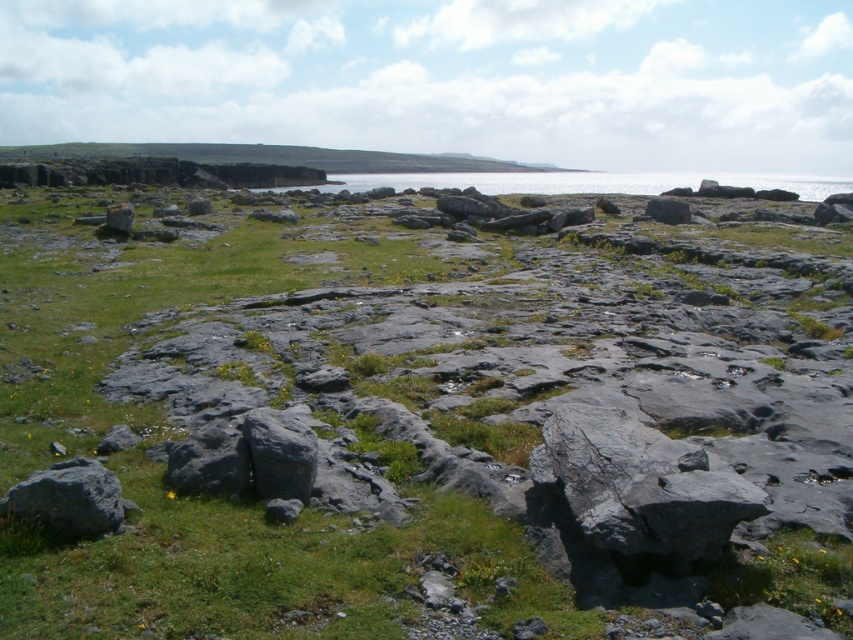
Can you confirm if green grassy hillside at upper center is thinner than gray rough rock at center?

In fact, green grassy hillside at upper center might be wider than gray rough rock at center.

Is green grassy hillside at upper center wider than gray rough rock at center?

Indeed, green grassy hillside at upper center has a greater width compared to gray rough rock at center.

This screenshot has width=853, height=640. What are the coordinates of `green grassy hillside at upper center` in the screenshot? It's located at 277,156.

Identify the location of green grassy hillside at upper center. This screenshot has height=640, width=853. (277, 156).

Is gray rock at center to the left of gray rough rock at lower left from the viewer's perspective?

Incorrect, gray rock at center is not on the left side of gray rough rock at lower left.

Is gray rock at center behind gray rough rock at lower left?

That is False.

Image resolution: width=853 pixels, height=640 pixels. In order to click on gray rock at center in this screenshot , I will do `click(434, 417)`.

Which of these two, gray rock at center or green grassy hillside at upper center, stands taller?

green grassy hillside at upper center

Can you confirm if gray rock at center is bigger than green grassy hillside at upper center?

Actually, gray rock at center might be smaller than green grassy hillside at upper center.

What do you see at coordinates (434, 417) in the screenshot? I see `gray rock at center` at bounding box center [434, 417].

Where is `gray rock at center`? gray rock at center is located at coordinates (434, 417).